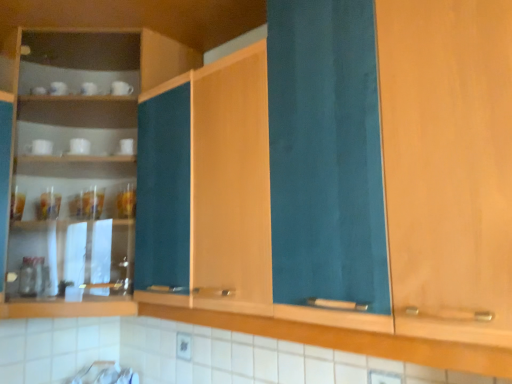
Question: Is wooden cabinet at left, the 2th cabinetry from the right, taller or shorter than teal fabric cabinet at center, which is counted as the 1th cabinetry, starting from the right?

Choices:
 (A) short
 (B) tall

Answer: (B)

Question: Is point (14, 178) positioned closer to the camera than point (217, 201)?

Choices:
 (A) closer
 (B) farther

Answer: (B)

Question: Estimate the real-world distances between objects in this image. Which object is closer to the wooden cabinet at left, which ranks as the first cabinetry in left-to-right order?

Choices:
 (A) teal fabric cabinet at center, which is counted as the 2th cabinetry, starting from the left
 (B) white glossy cup at left

Answer: (B)

Question: Which is nearer to the teal fabric cabinet at center, which is counted as the 2th cabinetry, starting from the left?

Choices:
 (A) wooden cabinet at left, which ranks as the first cabinetry in left-to-right order
 (B) white glossy cup at left

Answer: (A)